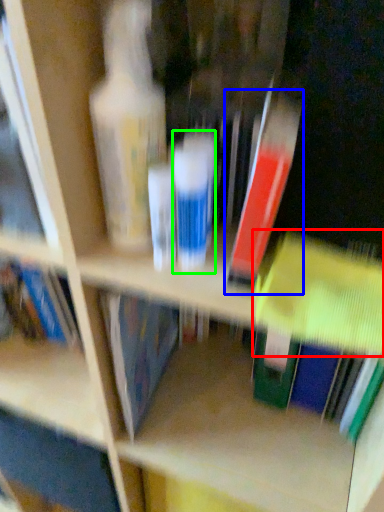
Question: Which object is positioned farthest from book (highlighted by a red box)? Select from book (highlighted by a blue box) and toiletry (highlighted by a green box).

Choices:
 (A) book
 (B) toiletry

Answer: (B)